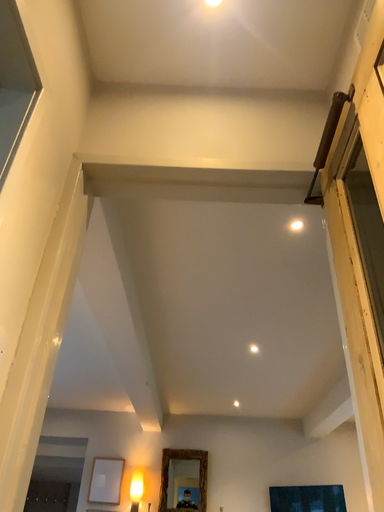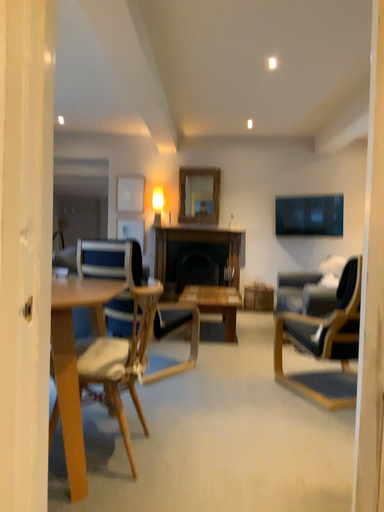
Question: How did the camera likely rotate when shooting the video?

Choices:
 (A) rotated upward
 (B) rotated downward

Answer: (B)